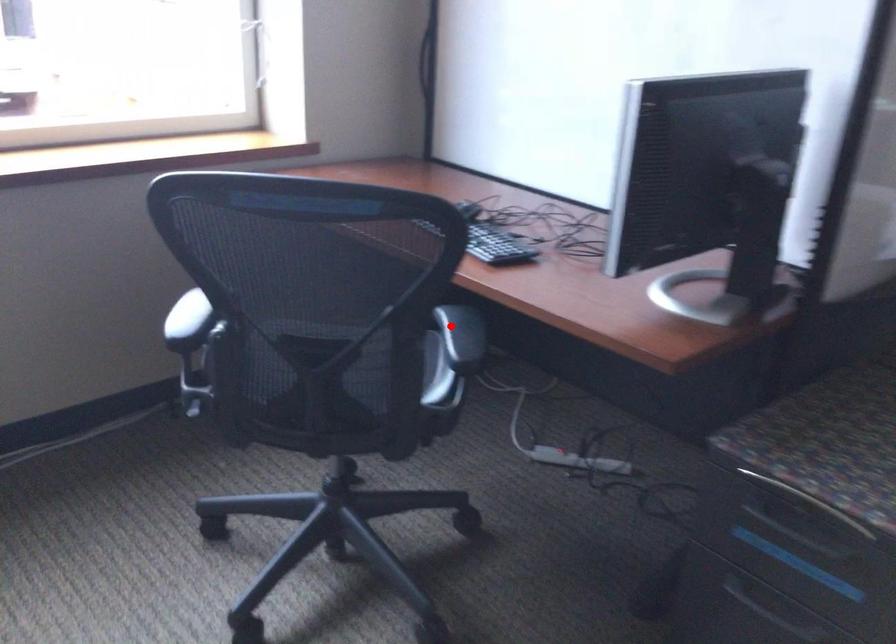
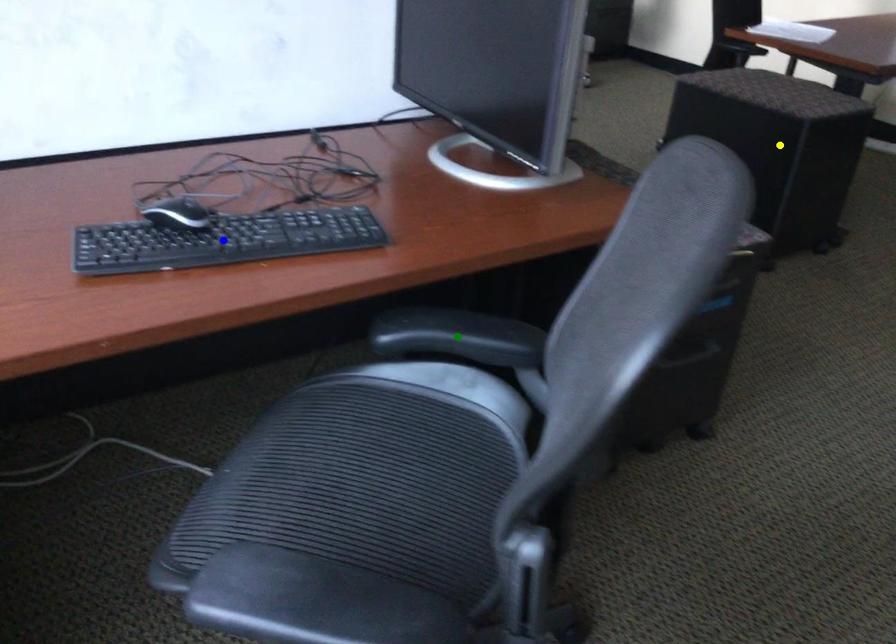
Question: I am providing you with two images of the same scene from different viewpoints. A red point is marked on the first image. You are given multiple points on the second image. Which spot in image 2 lines up with the point in image 1?

Choices:
 (A) yellow point
 (B) blue point
 (C) green point

Answer: (C)